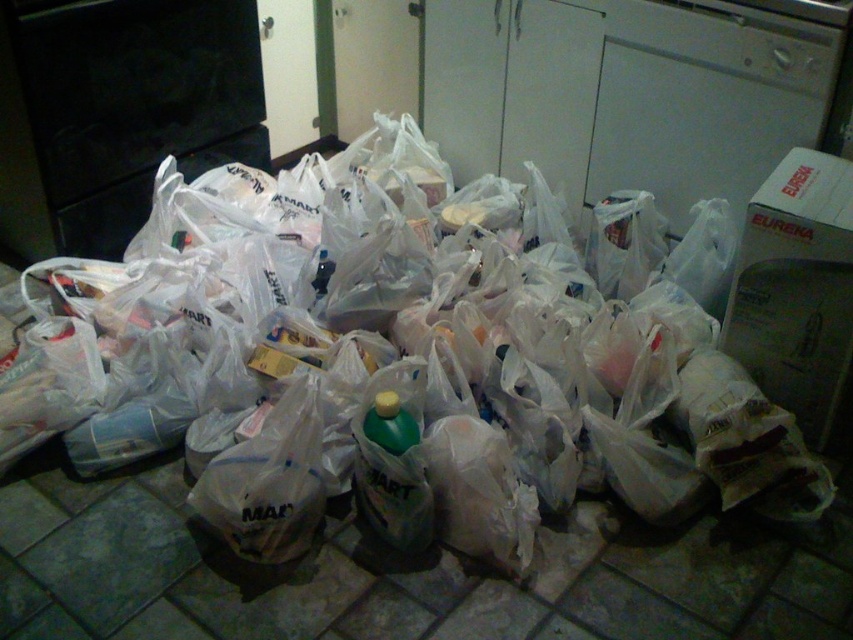
You are standing in a kitchen and see two points marked on the floor where plastic bags are piled. The first point is at coordinates point (21, 225), and the second is at point (363, 513). Which point is closer to you?

Point (21, 225) is closer to you because it is further to the viewer than point (363, 513).

You are organizing the items in the kitchen and notice the transparent plastic bags at center and the green plastic bottle at center. Which item takes up more space in the pile?

The transparent plastic bags at center are larger in size than the green plastic bottle at center, so they take up more space in the pile.